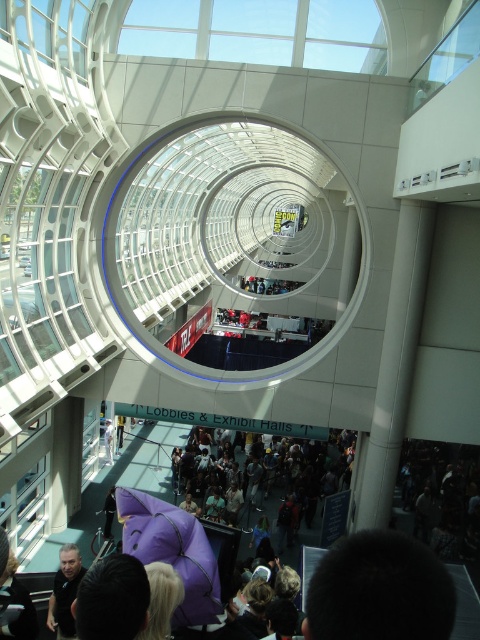
Is purple fabric crowd at lower center closer to camera compared to dark gray shirt at lower left?

That is True.

Which is more to the left, purple fabric crowd at lower center or dark gray shirt at lower left?

Positioned to the left is dark gray shirt at lower left.

You are a GUI agent. You are given a task and a screenshot of the screen. Output one action in this format:
    pyautogui.click(x=<x>, y=<y>)
    Task: Click on the purple fabric crowd at lower center
    The image size is (480, 640).
    Given the screenshot: What is the action you would take?
    pyautogui.click(x=465, y=605)

Where is `purple fabric crowd at lower center`? The width and height of the screenshot is (480, 640). purple fabric crowd at lower center is located at coordinates (465, 605).

Does purple fabric crowd at lower center have a smaller size compared to purple plush toy at center?

No.

The height and width of the screenshot is (640, 480). In order to click on purple fabric crowd at lower center in this screenshot , I will do `click(465, 605)`.

You are a GUI agent. You are given a task and a screenshot of the screen. Output one action in this format:
    pyautogui.click(x=<x>, y=<y>)
    Task: Click on the purple fabric crowd at lower center
    
    Given the screenshot: What is the action you would take?
    pyautogui.click(x=465, y=605)

Does purple fabric umbrella at center lie in front of purple plush toy at center?

Yes, it is.

Who is lower down, purple fabric umbrella at center or purple plush toy at center?

purple plush toy at center is below.

Image resolution: width=480 pixels, height=640 pixels. I want to click on purple fabric umbrella at center, so click(x=171, y=550).